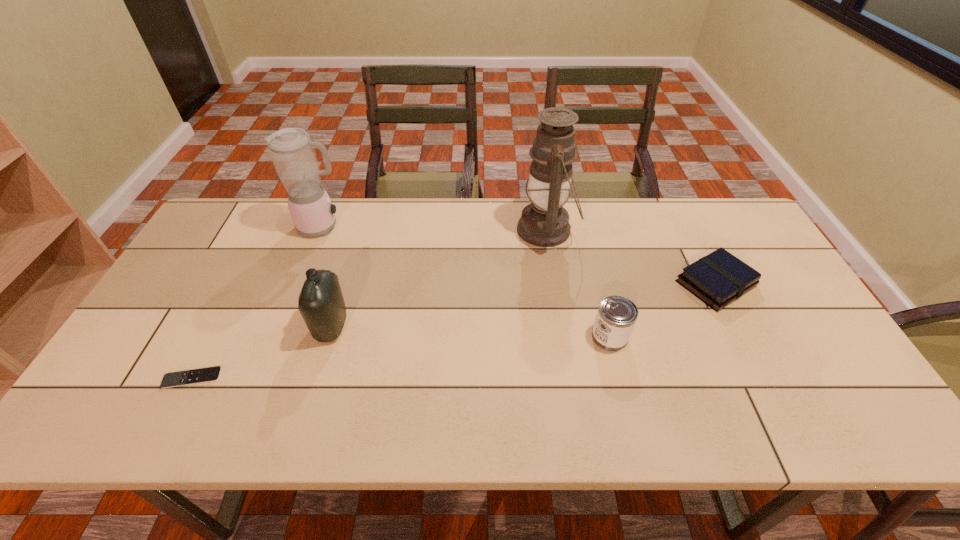
I want to click on vacant space located on the right of the tallest object, so click(626, 230).

At what (x,y) coordinates should I click in order to perform the action: click on free space located 0.280m on the base of the fifth shortest object near the control knob. Please return your answer as a coordinate pair (x, y). Image resolution: width=960 pixels, height=540 pixels. Looking at the image, I should click on click(434, 227).

This screenshot has height=540, width=960. In order to click on vacant area situated 0.160m on the right of the bottle in this screenshot , I will do `click(409, 327)`.

Identify the location of free space located 0.180m on the back of the fourth tallest object. (594, 273).

You are a GUI agent. You are given a task and a screenshot of the screen. Output one action in this format:
    pyautogui.click(x=<x>, y=<y>)
    Task: Click on the free space located on the left of the book
    
    Given the screenshot: What is the action you would take?
    pyautogui.click(x=606, y=284)

Identify the location of free space located on the back of the shortest object. (228, 307).

At what (x,y) coordinates should I click in order to perform the action: click on oil lamp positioned at the far edge. Please return your answer as a coordinate pair (x, y). Looking at the image, I should click on (544, 222).

You are a GUI agent. You are given a task and a screenshot of the screen. Output one action in this format:
    pyautogui.click(x=<x>, y=<y>)
    Task: Click on the food processor that is positioned at the far edge
    This screenshot has width=960, height=540.
    Given the screenshot: What is the action you would take?
    point(292,151)

Locate an element on the screen. object located in the left edge section of the desktop is located at coordinates (181, 378).

Locate an element on the screen. Image resolution: width=960 pixels, height=540 pixels. object that is at the right edge is located at coordinates (719, 278).